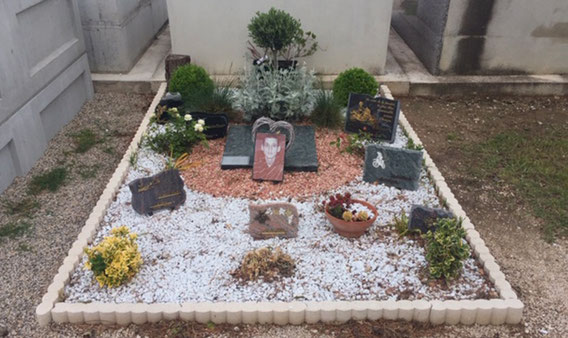
This screenshot has width=568, height=338. What are the coordinates of `leftmost wall` in the screenshot? It's located at (44, 92).